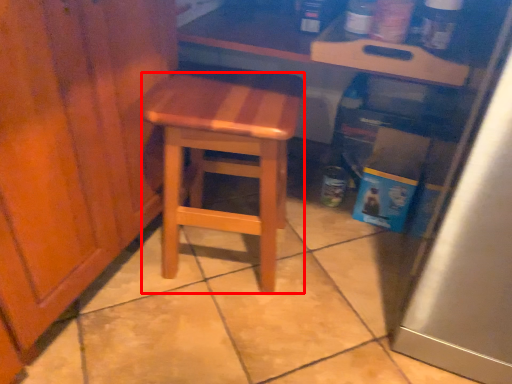
Question: Considering the relative positions of stool (annotated by the red box) and counter in the image provided, where is stool (annotated by the red box) located with respect to the staircase?

Choices:
 (A) right
 (B) left

Answer: (B)